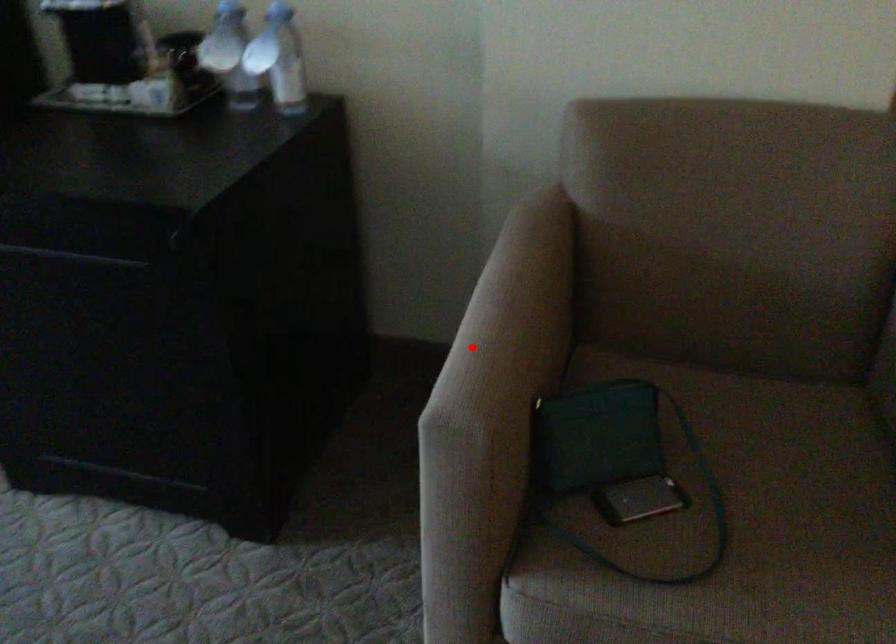
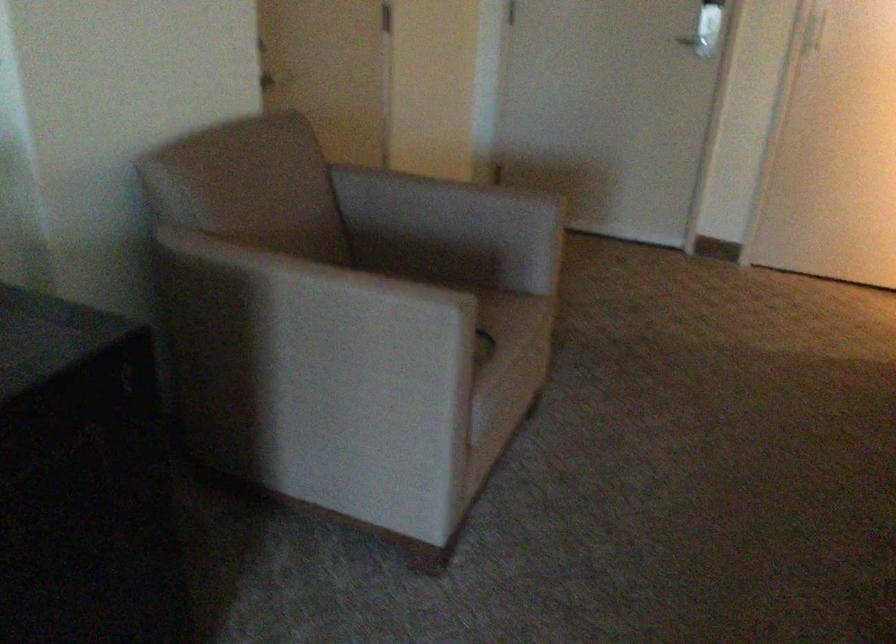
Question: I am providing you with two images of the same scene from different viewpoints. A red point is shown in image1. For the corresponding object point in image2, is it positioned nearer or farther from the camera?

Choices:
 (A) Nearer
 (B) Farther

Answer: (B)